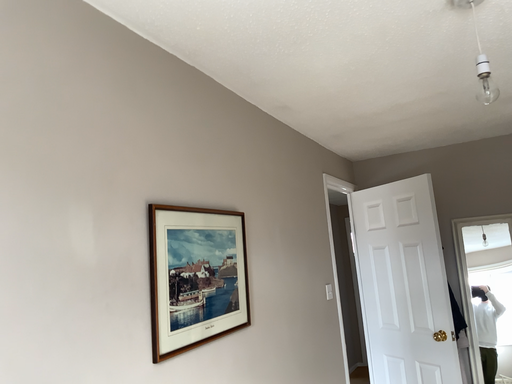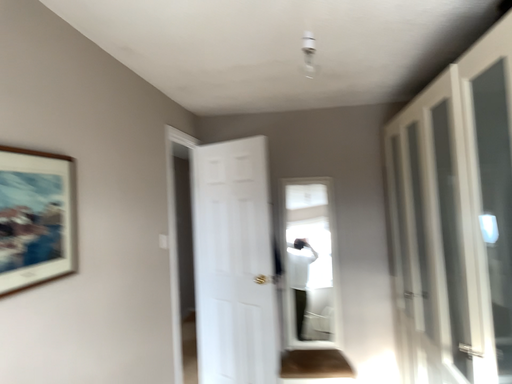
Question: Which way did the camera rotate in the video?

Choices:
 (A) rotated left
 (B) rotated right

Answer: (B)